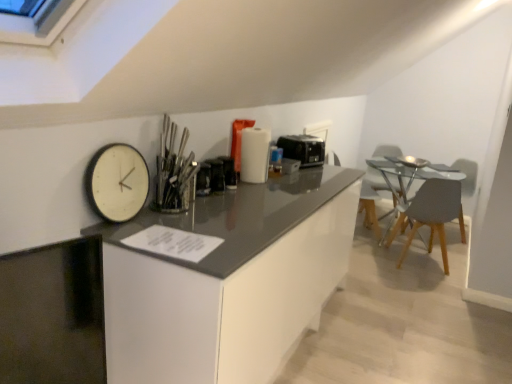
You are a GUI agent. You are given a task and a screenshot of the screen. Output one action in this format:
    pyautogui.click(x=<x>, y=<y>)
    Task: Click on the matte gray armchair at right
    
    Given the screenshot: What is the action you would take?
    pyautogui.click(x=466, y=173)

Is matte gray armchair at right located outside light gray wood chair at right, the 1th chair positioned from the left?

matte gray armchair at right lies outside light gray wood chair at right, the 1th chair positioned from the left,'s area.

Could you measure the distance between matte gray armchair at right and light gray wood chair at right, the 1th chair positioned from the left?

They are 34.16 inches apart.

From a real-world perspective, is matte gray armchair at right positioned above or below light gray wood chair at right, which is counted as the 2th chair, starting from the right?

In terms of real-world spatial position, matte gray armchair at right is below light gray wood chair at right, which is counted as the 2th chair, starting from the right.

From the image's perspective, is matte gray armchair at right above or below light gray wood chair at right, the 1th chair positioned from the left?

matte gray armchair at right is below light gray wood chair at right, the 1th chair positioned from the left.

Which is more to the right, white matte clock at left or white glossy cabinetry at center?

Positioned to the right is white glossy cabinetry at center.

Is white glossy cabinetry at center inside white matte clock at left?

No, white glossy cabinetry at center is not inside white matte clock at left.

From the image's perspective, which is above, white matte clock at left or white glossy cabinetry at center?

From the image's view, white matte clock at left is above.

From a real-world perspective, is white matte clock at left on top of white glossy cabinetry at center?

Indeed, from a real-world perspective, white matte clock at left stands above white glossy cabinetry at center.

Find the location of a particular element. The width and height of the screenshot is (512, 384). swivel chair to the right of white glossy cabinetry at center is located at coordinates (376, 180).

Based on their sizes in the image, would you say white plastic swivel chair at right is bigger or smaller than white glossy cabinetry at center?

In the image, white plastic swivel chair at right appears to be smaller than white glossy cabinetry at center.

Can white glossy cabinetry at center be found inside white plastic swivel chair at right?

No, white glossy cabinetry at center is located outside of white plastic swivel chair at right.

The image size is (512, 384). I want to click on silverware lying in front of the matte gray armchair at right, so click(x=173, y=170).

Does polished metal utensils at center have a smaller size compared to matte gray armchair at right?

Indeed, polished metal utensils at center has a smaller size compared to matte gray armchair at right.

Is polished metal utensils at center positioned before matte gray armchair at right?

Yes, it is.

Would you consider polished metal utensils at center to be distant from matte gray armchair at right?

That's right, there is a large distance between polished metal utensils at center and matte gray armchair at right.

Is matte gray armchair at right closer to the viewer compared to black plastic toaster at center, which is the second appliance from left to right?

No, matte gray armchair at right is behind black plastic toaster at center, which is the second appliance from left to right.

Between matte gray armchair at right and black plastic toaster at center, which is the second appliance from left to right, which one has less height?

With less height is black plastic toaster at center, which is the second appliance from left to right.

Considering the relative sizes of matte gray armchair at right and black plastic toaster at center, which is the second appliance from left to right, in the image provided, is matte gray armchair at right smaller than black plastic toaster at center, which is the second appliance from left to right,?

No, matte gray armchair at right is not smaller than black plastic toaster at center, which is the second appliance from left to right.

Considering the relative sizes of light gray wood chair at right, the 1th chair positioned from the left, and white paper towel at center, the 1th appliance positioned from the left, in the image provided, is light gray wood chair at right, the 1th chair positioned from the left, thinner than white paper towel at center, the 1th appliance positioned from the left,?

No.

Is white paper towel at center, marked as the second appliance in a back-to-front arrangement, a part of light gray wood chair at right, the 1th chair positioned from the left?

No, white paper towel at center, marked as the second appliance in a back-to-front arrangement, is not a part of light gray wood chair at right, the 1th chair positioned from the left.

From the image's perspective, between light gray wood chair at right, which is counted as the 2th chair, starting from the right, and white paper towel at center, the first appliance positioned from the front, who is located below?

light gray wood chair at right, which is counted as the 2th chair, starting from the right.

Is light gray wood chair at right, which is counted as the 2th chair, starting from the right, oriented towards white paper towel at center, the second appliance when ordered from right to left?

No, light gray wood chair at right, which is counted as the 2th chair, starting from the right, does not turn towards white paper towel at center, the second appliance when ordered from right to left.

How different are the orientations of white glossy cabinetry at center and matte gray armchair at right in degrees?

133 degrees.

Between white glossy cabinetry at center and matte gray armchair at right, which one appears on the left side from the viewer's perspective?

white glossy cabinetry at center is more to the left.

Considering the relative positions of white glossy cabinetry at center and matte gray armchair at right in the image provided, is white glossy cabinetry at center behind matte gray armchair at right?

No, white glossy cabinetry at center is in front of matte gray armchair at right.

Locate an element on the screen. The image size is (512, 384). cabinetry above the matte gray armchair at right (from a real-world perspective) is located at coordinates (228, 281).

You are a GUI agent. You are given a task and a screenshot of the screen. Output one action in this format:
    pyautogui.click(x=<x>, y=<y>)
    Task: Click on the 2nd chair to the left of the matte gray armchair at right, counting from the anchor's position
    
    Given the screenshot: What is the action you would take?
    pyautogui.click(x=370, y=210)

This screenshot has width=512, height=384. In order to click on cabinetry below the white matte clock at left (from a real-world perspective) in this screenshot , I will do `click(228, 281)`.

When comparing their distances from white plastic swivel chair at right, does white paper towel at center, the second appliance when ordered from right to left, or matte gray armchair at right seem closer?

The object closer to white plastic swivel chair at right is matte gray armchair at right.

Looking at this image, looking at the image, which one is located further to white plastic swivel chair at right, white glossy cabinetry at center or white matte clock at left?

Based on the image, white matte clock at left appears to be further to white plastic swivel chair at right.

Based on the photo, looking at the image, which one is located closer to white paper towel at center, the second appliance when ordered from right to left, matte gray armchair at right or white matte clock at left?

white matte clock at left lies closer to white paper towel at center, the second appliance when ordered from right to left, than the other object.

Looking at the image, which one is located closer to matte gray chair at right, which is counted as the 1th chair, starting from the right, white paper towel at center, the first appliance positioned from the front, or light gray wood chair at right, the 1th chair positioned from the left?

light gray wood chair at right, the 1th chair positioned from the left, is closer to matte gray chair at right, which is counted as the 1th chair, starting from the right.

Based on their spatial positions, is matte gray armchair at right or black plastic toaster at center, the first appliance in the back-to-front sequence, closer to white matte clock at left?

Based on the image, black plastic toaster at center, the first appliance in the back-to-front sequence, appears to be nearer to white matte clock at left.

Considering their positions, is polished metal utensils at center positioned closer to black plastic toaster at center, the first appliance in the back-to-front sequence, than matte gray chair at right, which ranks as the 2th chair in left-to-right order?

polished metal utensils at center.

Based on their spatial positions, is light gray wood chair at right, which is counted as the 2th chair, starting from the right, or white glossy cabinetry at center closer to white paper towel at center, marked as the second appliance in a back-to-front arrangement?

Based on the image, white glossy cabinetry at center appears to be nearer to white paper towel at center, marked as the second appliance in a back-to-front arrangement.

Estimate the real-world distances between objects in this image. Which object is further from matte gray chair at right, which ranks as the 2th chair in left-to-right order, light gray wood chair at right, the 1th chair positioned from the left, or black plastic toaster at center, the first appliance in the back-to-front sequence?

black plastic toaster at center, the first appliance in the back-to-front sequence, lies further to matte gray chair at right, which ranks as the 2th chair in left-to-right order, than the other object.

Where is `wall clock between white glossy cabinetry at center and white paper towel at center, marked as the second appliance in a back-to-front arrangement, from front to back`? This screenshot has width=512, height=384. wall clock between white glossy cabinetry at center and white paper towel at center, marked as the second appliance in a back-to-front arrangement, from front to back is located at coordinates [x=117, y=182].

At what (x,y) coordinates should I click in order to perform the action: click on wall clock between white glossy cabinetry at center and white plastic swivel chair at right in the front-back direction. Please return your answer as a coordinate pair (x, y). The height and width of the screenshot is (384, 512). Looking at the image, I should click on (117, 182).

The height and width of the screenshot is (384, 512). I want to click on silverware between white matte clock at left and white plastic swivel chair at right in the front-back direction, so click(173, 170).

The image size is (512, 384). In order to click on chair between polished metal utensils at center and light gray wood chair at right, which is counted as the 2th chair, starting from the right, along the z-axis in this screenshot , I will do `click(430, 214)`.